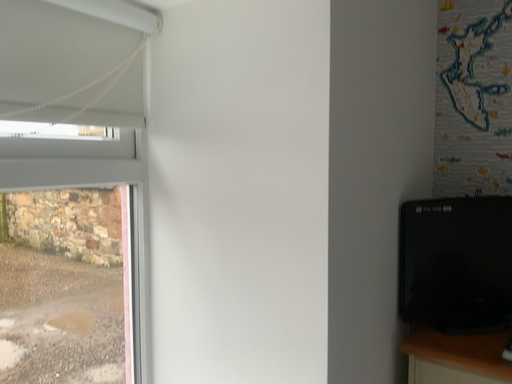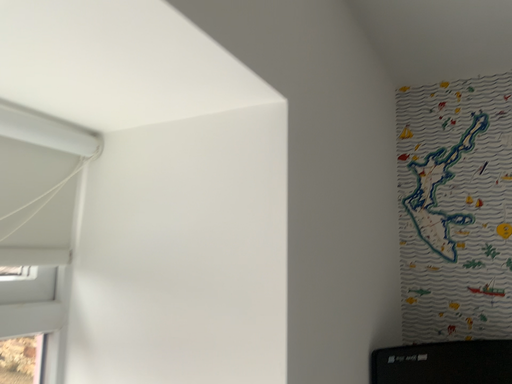
Question: How did the camera likely rotate when shooting the video?

Choices:
 (A) rotated upward
 (B) rotated downward

Answer: (A)